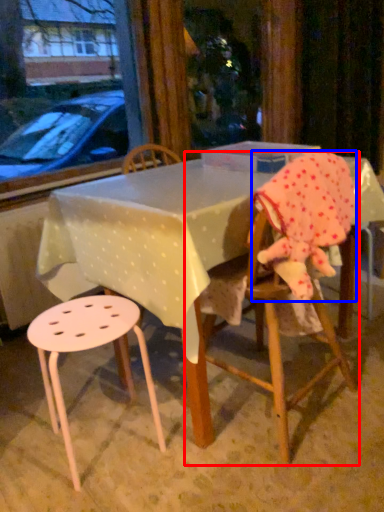
Question: Among these objects, which one is nearest to the camera, chair (highlighted by a red box) or toddler (highlighted by a blue box)?

Choices:
 (A) chair
 (B) toddler

Answer: (B)